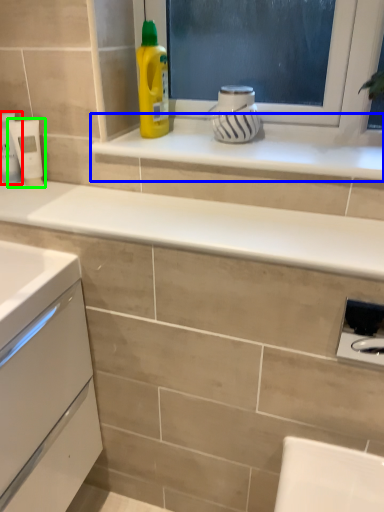
Question: Considering the real-world distances, which object is farthest from toiletry (highlighted by a red box)? window sill (highlighted by a blue box) or appliance (highlighted by a green box)?

Choices:
 (A) window sill
 (B) appliance

Answer: (A)